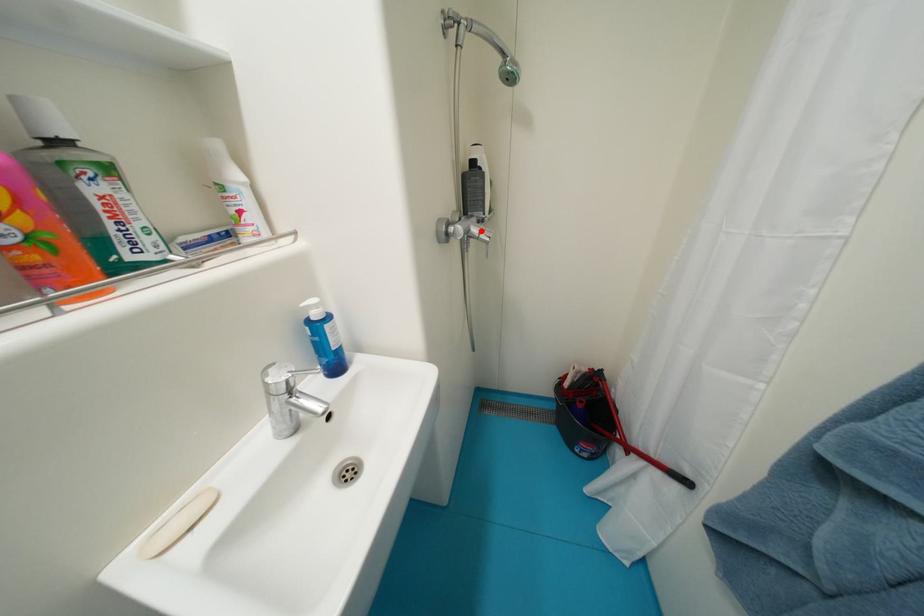
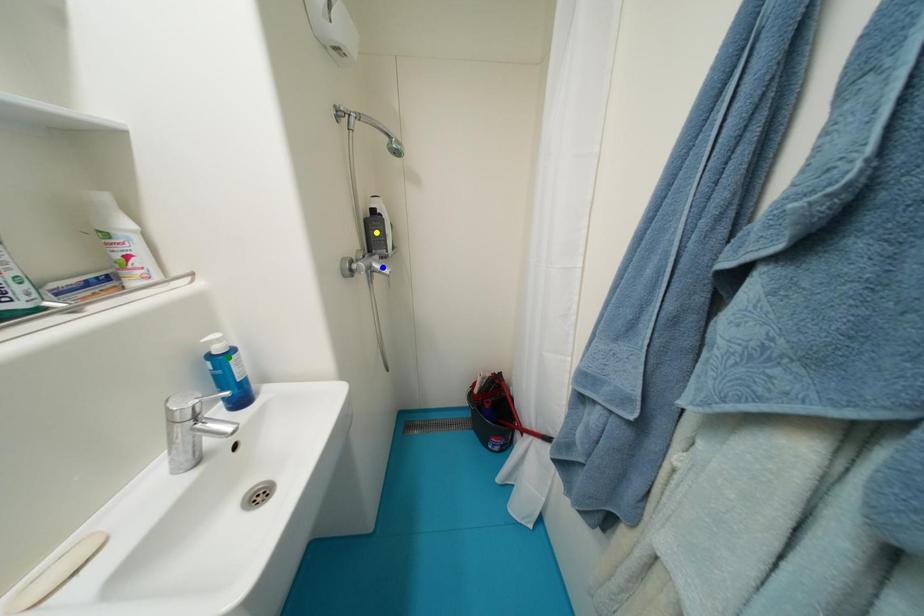
Question: I am providing you with two images of the same scene from different viewpoints. A red point is marked on the first image. You are given multiple points on the second image. Which point in image 2 is actually the same real-world point as the red point in image 1?

Choices:
 (A) green point
 (B) yellow point
 (C) blue point

Answer: (C)